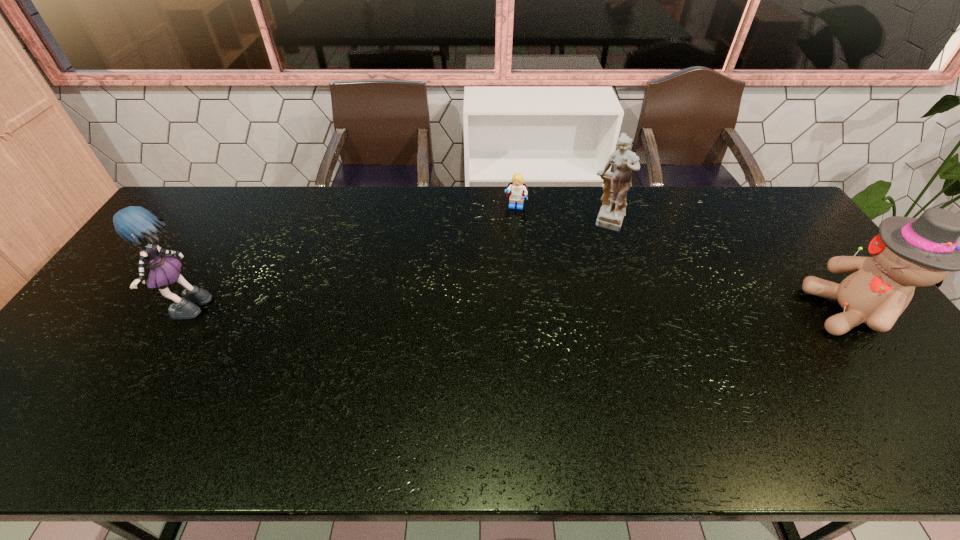
The image size is (960, 540). Identify the location of free space located on the front-facing side of the rightmost object. (704, 312).

Where is `free space located 0.080m on the front-facing side of the second object from left to right`? Image resolution: width=960 pixels, height=540 pixels. free space located 0.080m on the front-facing side of the second object from left to right is located at coordinates (511, 227).

Find the location of `free point located on the front-facing side of the second object from left to right`. free point located on the front-facing side of the second object from left to right is located at coordinates (512, 222).

Where is `vacant space located on the front-facing side of the second object from left to right`? vacant space located on the front-facing side of the second object from left to right is located at coordinates (511, 231).

Where is `free region located on the front-facing side of the figurine`? The width and height of the screenshot is (960, 540). free region located on the front-facing side of the figurine is located at coordinates click(x=594, y=296).

Locate an element on the screen. The width and height of the screenshot is (960, 540). free space located 0.100m on the front-facing side of the figurine is located at coordinates (602, 258).

Identify the location of free spot located 0.320m on the front-facing side of the figurine. Image resolution: width=960 pixels, height=540 pixels. (591, 309).

Image resolution: width=960 pixels, height=540 pixels. I want to click on Lego present at the far edge, so click(517, 190).

I want to click on figurine that is at the far edge, so pyautogui.click(x=616, y=185).

The image size is (960, 540). Identify the location of object present at the right edge. (908, 252).